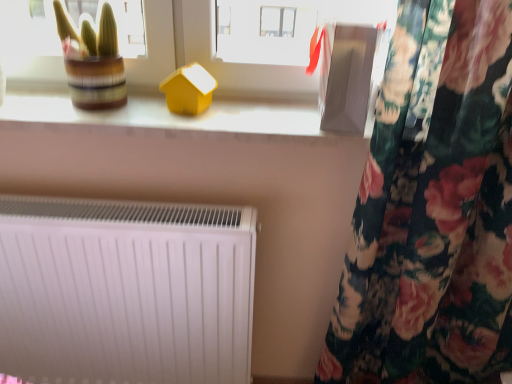
Where is `vacant space to the right of matte yellow house at center`? This screenshot has height=384, width=512. vacant space to the right of matte yellow house at center is located at coordinates tap(248, 116).